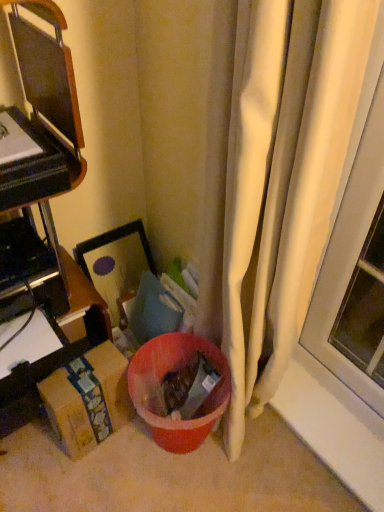
Question: Visually, is white fabric curtain at right positioned to the left or to the right of brown cardboard box at left, which ranks as the 2th furniture in top-to-bottom order?

Choices:
 (A) left
 (B) right

Answer: (B)

Question: From the image's perspective, is white fabric curtain at right located above or below brown cardboard box at left, which ranks as the 2th furniture in top-to-bottom order?

Choices:
 (A) above
 (B) below

Answer: (A)

Question: Which is farther from the white fabric curtain at right?

Choices:
 (A) brown cardboard box at lower left
 (B) brown cardboard box at left, which ranks as the 2th furniture in top-to-bottom order
 (C) brown cardboard box at left, the second furniture ordered from the bottom

Answer: (B)

Question: Based on their relative distances, which object is farther from the brown cardboard box at left, the second furniture ordered from the bottom?

Choices:
 (A) brown cardboard box at lower left
 (B) brown cardboard box at left, which is the first furniture in bottom-to-top order
 (C) white fabric curtain at right

Answer: (C)